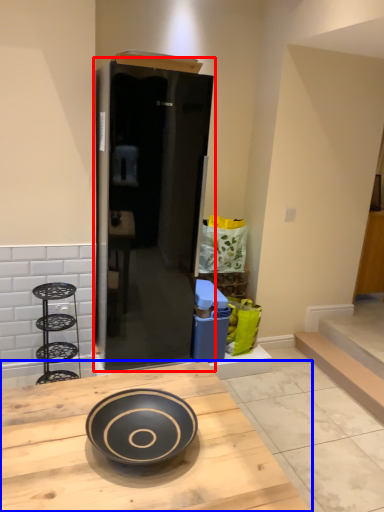
Question: Which point is further to the camera, door (highlighted by a red box) or kitchen & dining room table (highlighted by a blue box)?

Choices:
 (A) door
 (B) kitchen & dining room table

Answer: (A)